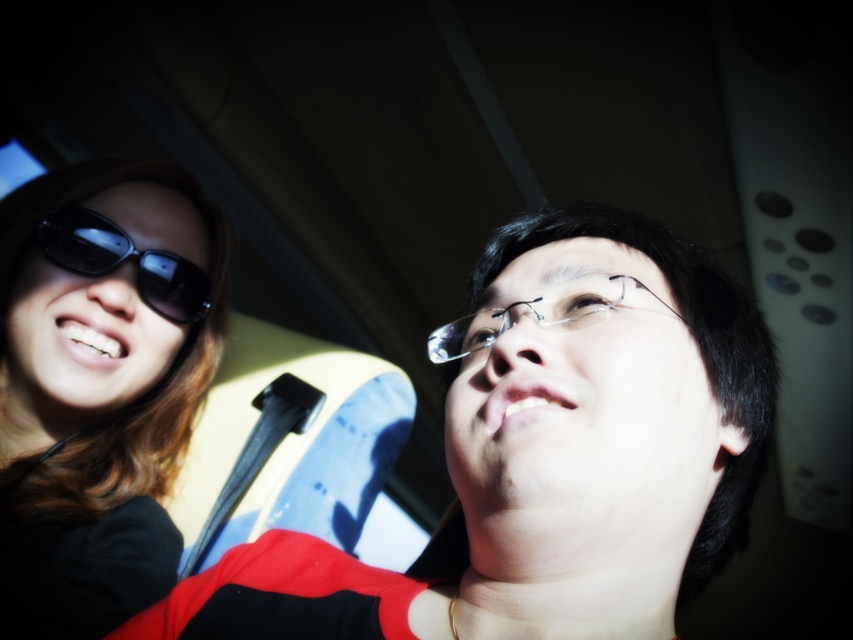
Does sunglasses at left have a larger size compared to clear plastic glasses at center?

Indeed, sunglasses at left has a larger size compared to clear plastic glasses at center.

Does point (88, 484) come closer to viewer compared to point (434, 342)?

No, (88, 484) is further to viewer.

Identify the location of sunglasses at left. The height and width of the screenshot is (640, 853). (100, 392).

Is point (238, 561) less distant than point (462, 346)?

Yes.

Is the position of matte black sunglasses at upper left less distant than that of clear plastic glasses at center?

Yes.

Is point (643, 400) closer to camera compared to point (556, 328)?

Yes, point (643, 400) is in front of point (556, 328).

Locate an element on the screen. The image size is (853, 640). matte black sunglasses at upper left is located at coordinates (548, 456).

Does sunglasses at left have a greater width compared to matte black sunglasses at left?

Correct, the width of sunglasses at left exceeds that of matte black sunglasses at left.

Does sunglasses at left appear under matte black sunglasses at left?

Yes.

Is point (131, 216) closer to camera compared to point (144, 276)?

No.

You are a GUI agent. You are given a task and a screenshot of the screen. Output one action in this format:
    pyautogui.click(x=<x>, y=<y>)
    Task: Click on the sunglasses at left
    The width and height of the screenshot is (853, 640).
    Given the screenshot: What is the action you would take?
    pyautogui.click(x=100, y=392)